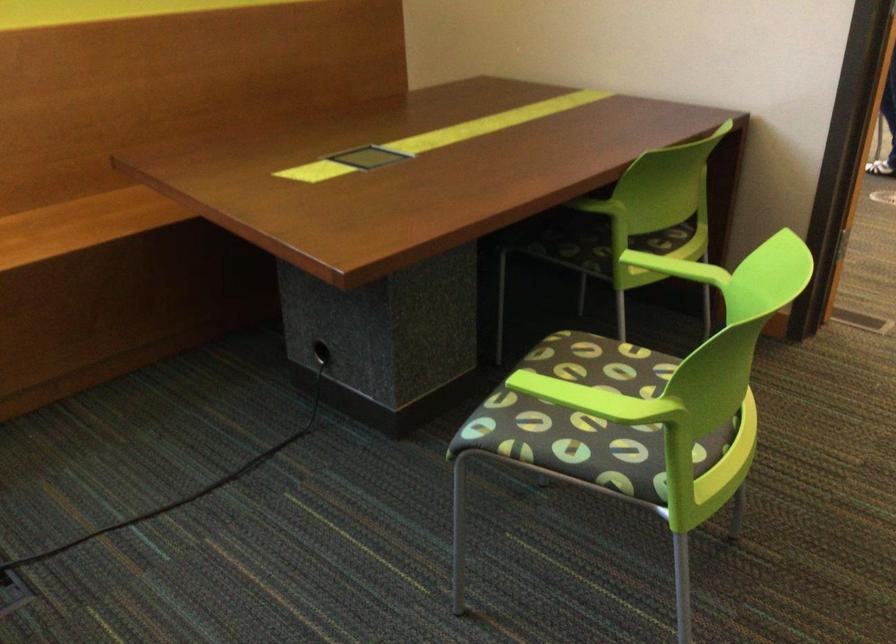
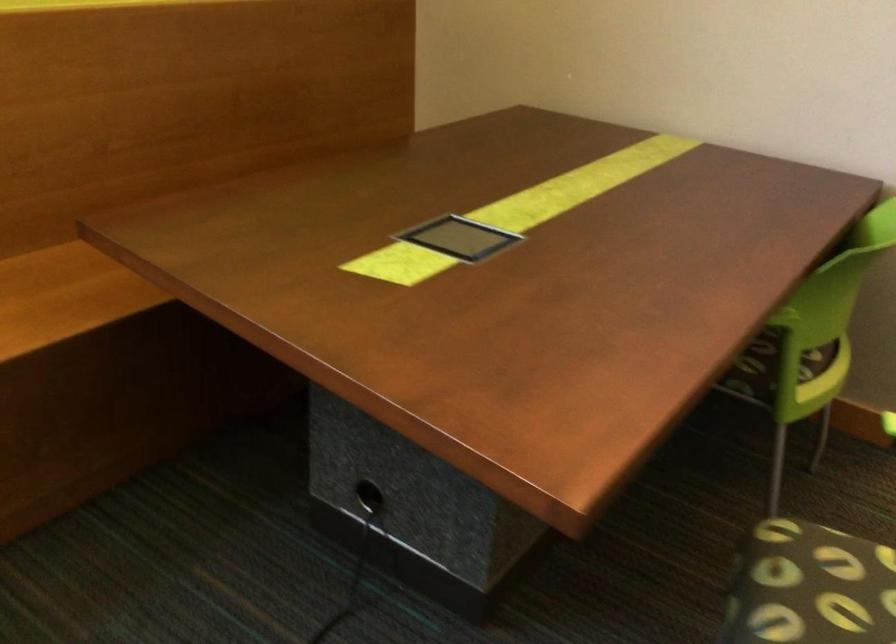
Question: The camera is either moving clockwise (left) or counter-clockwise (right) around the object. The first image is from the beginning of the video and the second image is from the end. Is the camera moving left or right when shooting the video?

Choices:
 (A) Left
 (B) Right

Answer: (A)